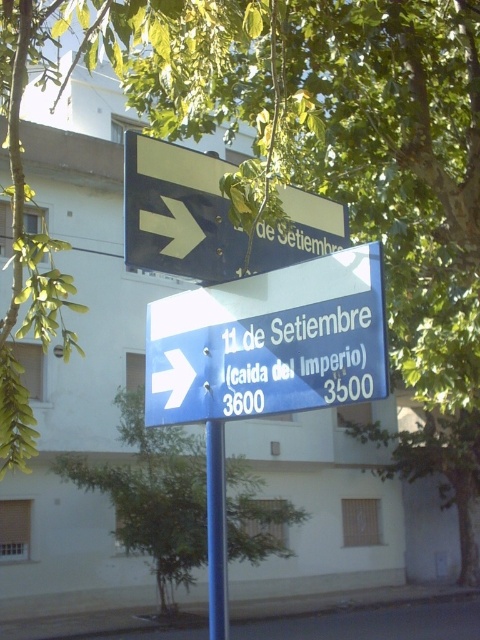
You are a pedestrian trying to follow the white plastic arrow at center on the street sign. There is a green leafy tree at lower center nearby. From the tree, in which direction should you walk to face the arrow?

The green leafy tree at lower center is to the left of the white plastic arrow at center, so you should walk to the right to face the arrow.

You are a delivery driver trying to read the street signs. You notice two signs, the blue plastic sign at center and the black plastic sign at upper right. Which one is larger in size?

The black plastic sign at upper right is larger than the blue plastic sign at center.

You are a delivery driver trying to read the street signs. You see the blue plastic sign at center and the black plastic sign at upper right. Which sign is located to the right of the other?

The blue plastic sign at center is positioned on the right side of black plastic sign at upper right, so the blue plastic sign at center is to the right of the black plastic sign at upper right.